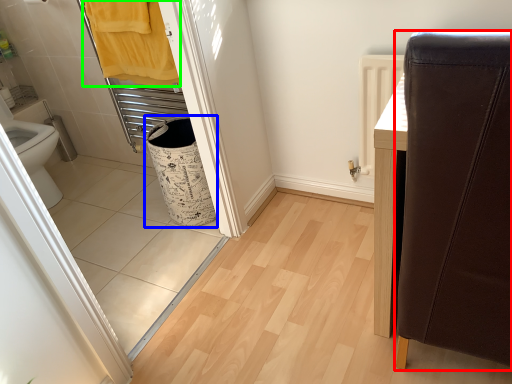
Question: Based on their relative distances, which object is farther from furniture (highlighted by a red box)? Choose from laundry basket (highlighted by a blue box) and bath towel (highlighted by a green box).

Choices:
 (A) laundry basket
 (B) bath towel

Answer: (B)